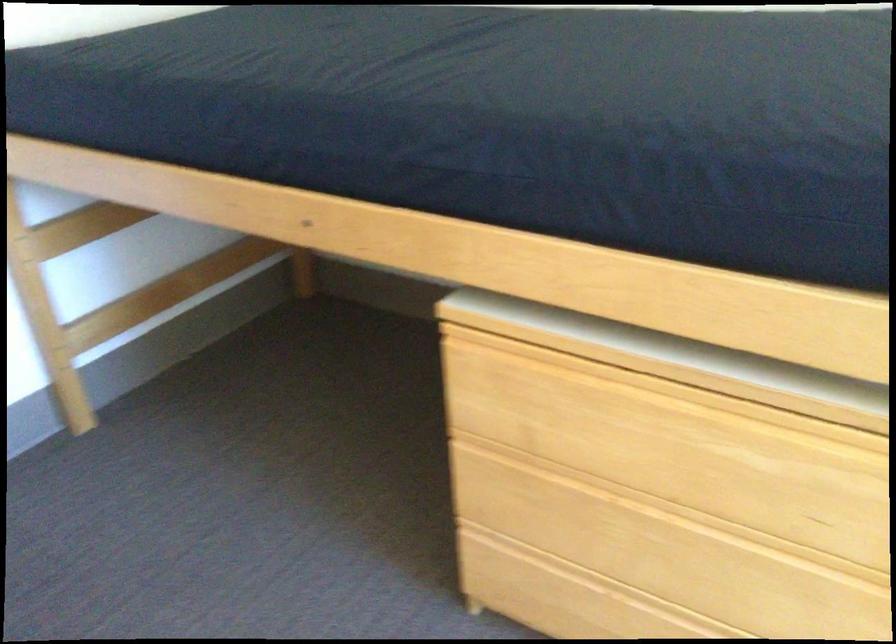
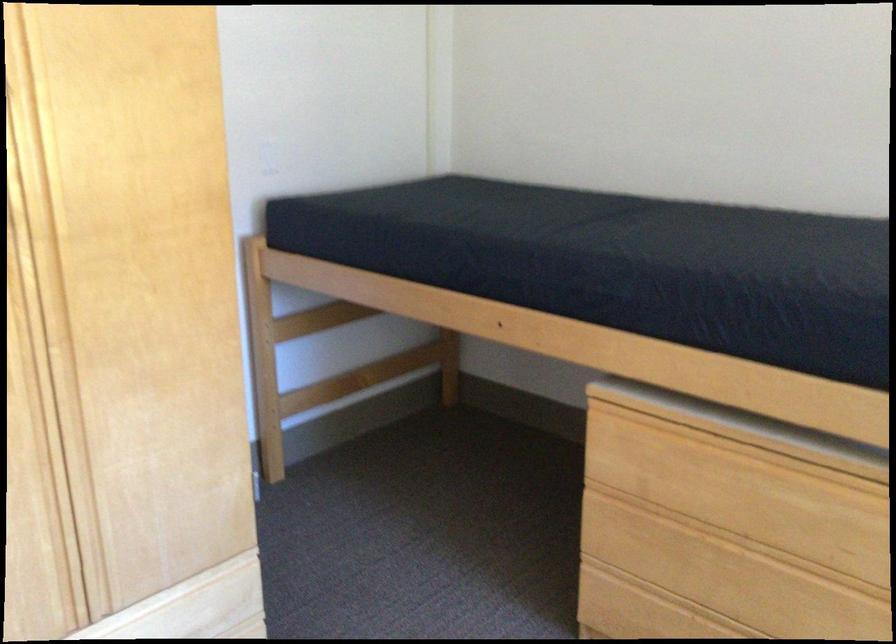
The point at (597, 533) is marked in the first image. Where is the corresponding point in the second image?

(699, 574)